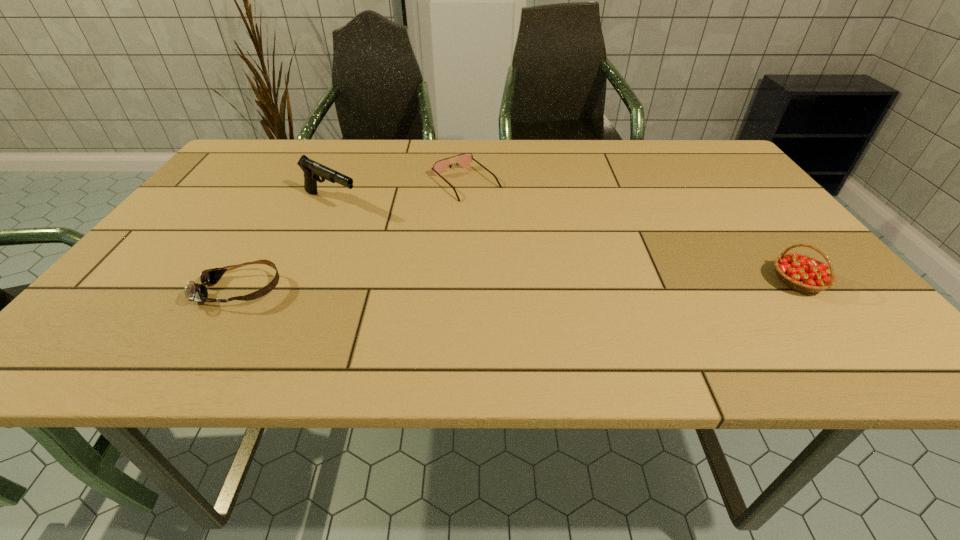
I want to click on vacant space on the desktop that is between the goggles and the strawberry and is positioned at the aiming end of the gun, so click(495, 287).

I want to click on vacant space on the desktop that is between the goggles and the third shortest object and is positioned on the bridge of the sunglasses, so click(x=587, y=285).